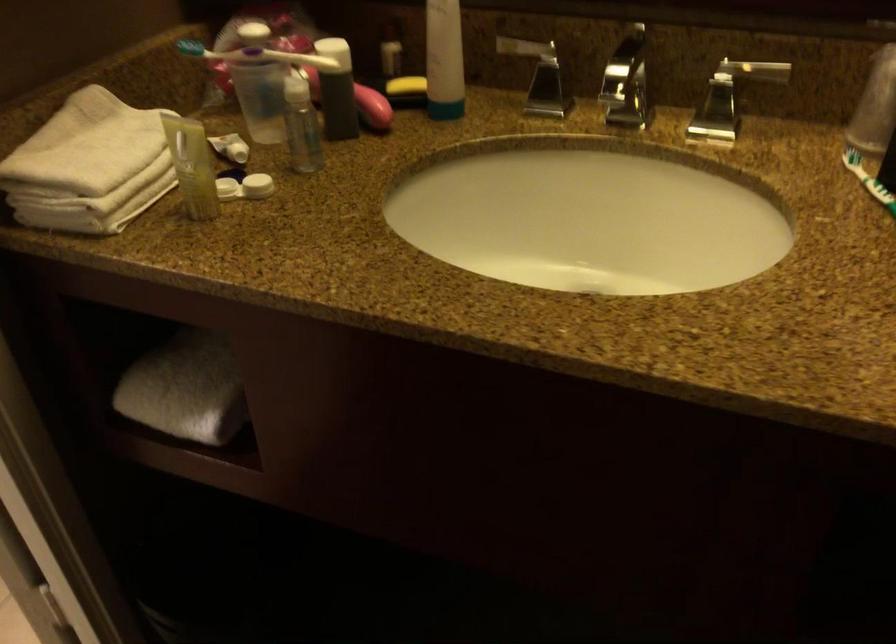
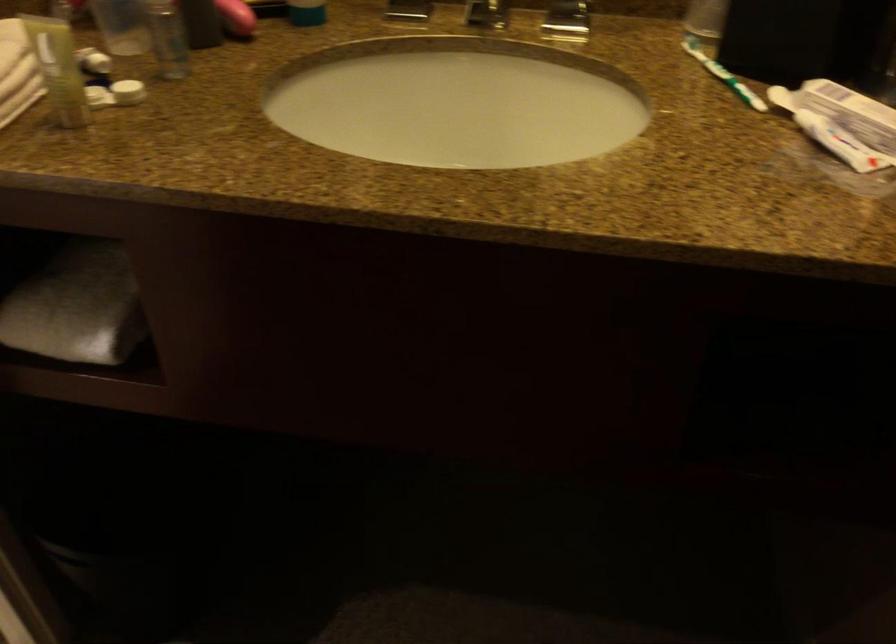
Locate, in the second image, the point that corresponds to point (589, 202) in the first image.

(457, 102)